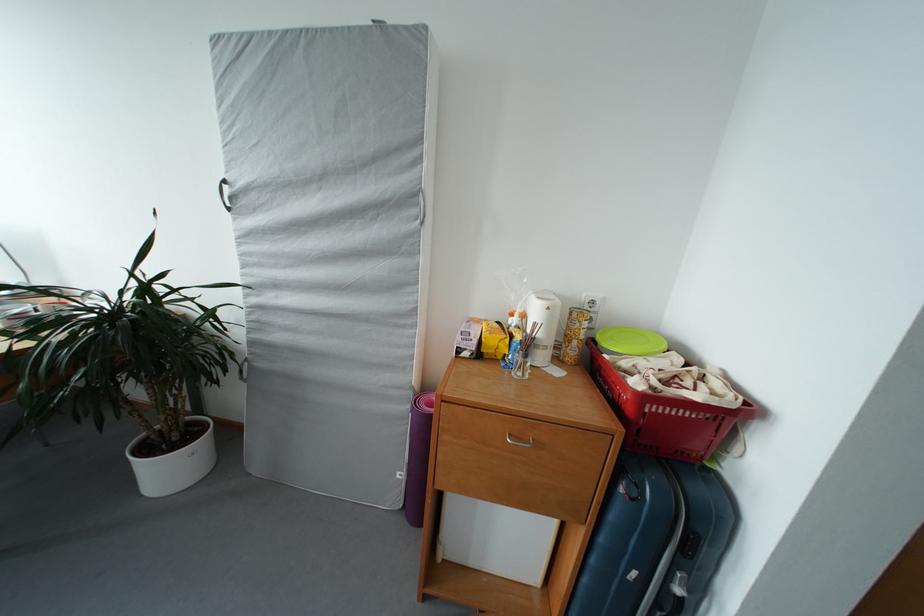
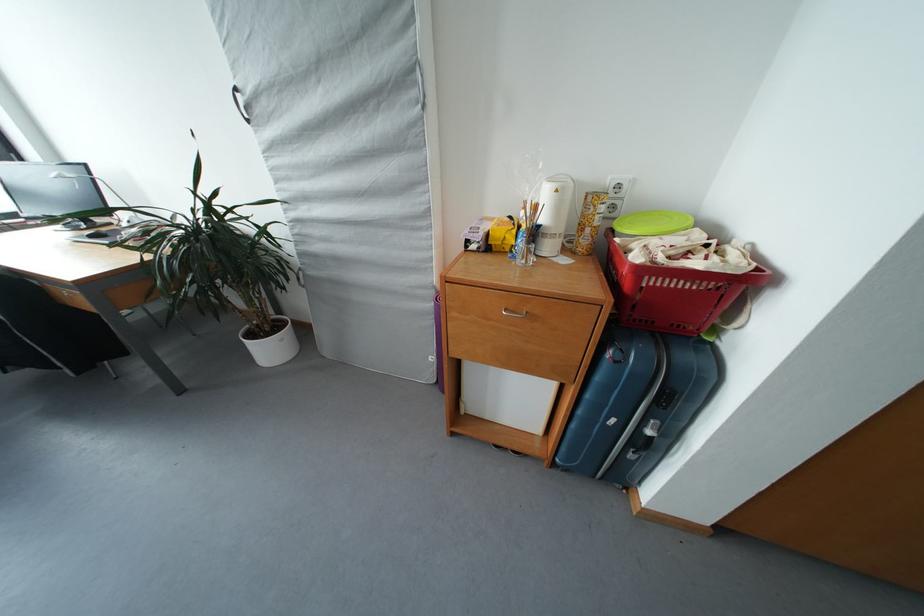
Find the pixel in the second image that matches the point at 155,454 in the first image.

(260, 339)